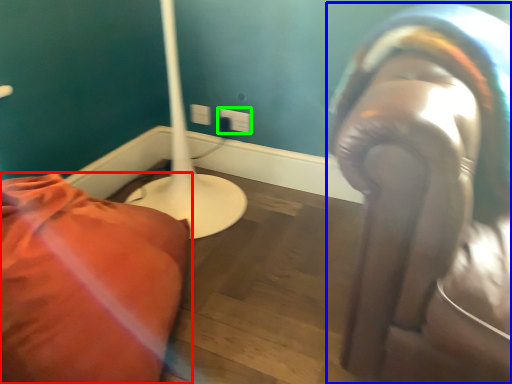
Question: Which object is the closest to the furniture (highlighted by a red box)? Choose among these: person (highlighted by a blue box) or electric outlet (highlighted by a green box).

Choices:
 (A) person
 (B) electric outlet

Answer: (A)